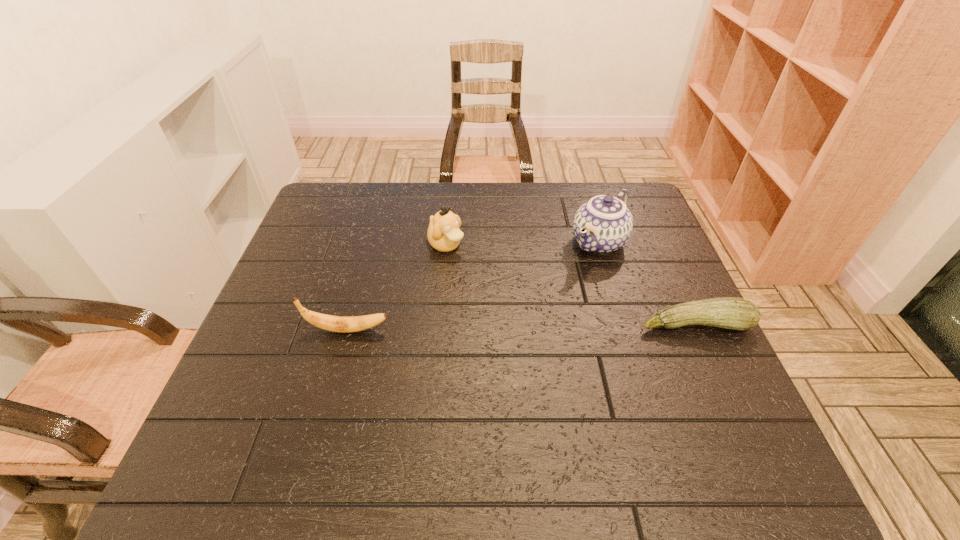
At what (x,y) coordinates should I click in order to perform the action: click on free spot on the desktop that is between the second shortest object and the shortest object and is positioned on the face of the third object from right to left. Please return your answer as a coordinate pair (x, y). The image size is (960, 540). Looking at the image, I should click on (547, 327).

Where is `free space on the desktop that is between the leftmost object and the shortest object and is positioned from the spout of the tallest object`? Image resolution: width=960 pixels, height=540 pixels. free space on the desktop that is between the leftmost object and the shortest object and is positioned from the spout of the tallest object is located at coordinates (505, 328).